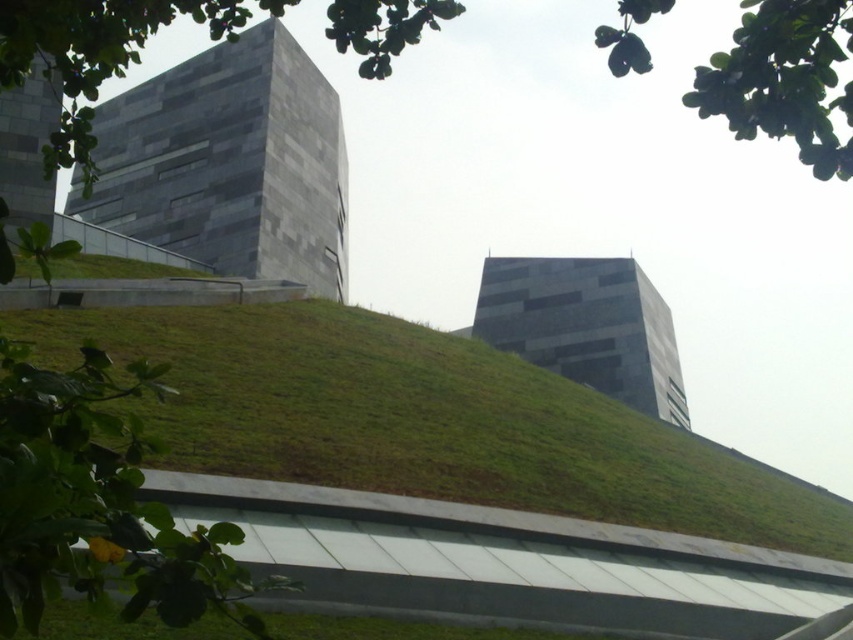
Question: Can you confirm if gray stone tower at upper left is smaller than green leafy tree at upper center?

Choices:
 (A) yes
 (B) no

Answer: (A)

Question: Is gray stone tower at upper left wider than dark gray stone tower at center?

Choices:
 (A) yes
 (B) no

Answer: (A)

Question: Does dark gray stone tower at center appear over gray stone building at upper left?

Choices:
 (A) no
 (B) yes

Answer: (A)

Question: Based on their relative distances, which object is farther from the gray stone building at upper left?

Choices:
 (A) dark gray stone tower at center
 (B) gray stone tower at upper left
 (C) green leafy tree at upper center
 (D) green grass at center

Answer: (A)

Question: Which of these objects is positioned farthest from the dark gray stone tower at center?

Choices:
 (A) green grass at center
 (B) gray stone tower at upper left
 (C) green leafy tree at upper center
 (D) gray stone building at upper left

Answer: (D)

Question: Which of the following is the farthest from the observer?

Choices:
 (A) gray stone tower at upper left
 (B) green grass at center
 (C) green leafy tree at upper center

Answer: (A)